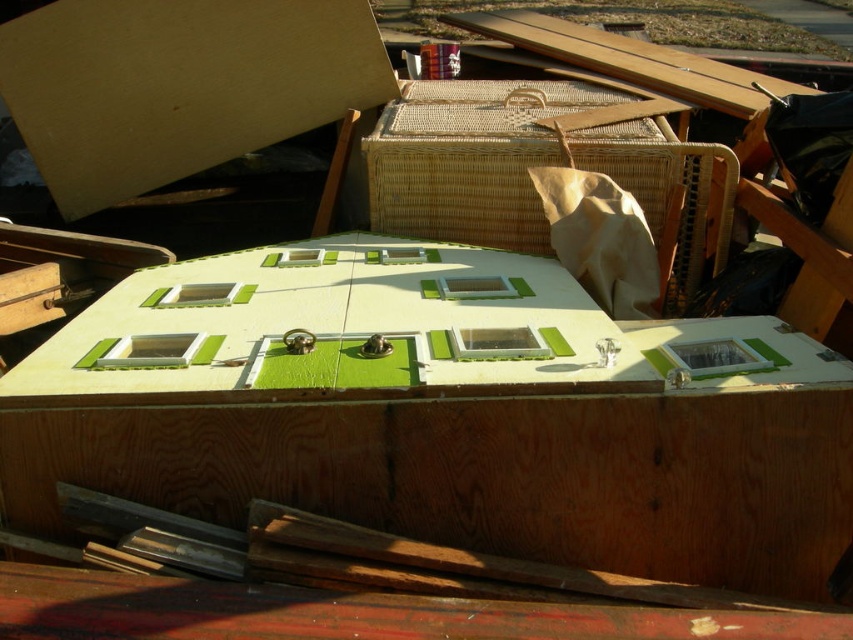
Question: Which object appears farthest from the camera in this image?

Choices:
 (A) matte cardboard at upper left
 (B) woven rattan crate at center

Answer: (A)

Question: Is matte cardboard at upper left bigger than woven rattan crate at center?

Choices:
 (A) no
 (B) yes

Answer: (A)

Question: Is matte cardboard at upper left thinner than woven rattan crate at center?

Choices:
 (A) yes
 (B) no

Answer: (B)

Question: Which point appears farthest from the camera in this image?

Choices:
 (A) tap(132, 188)
 (B) tap(505, 237)

Answer: (A)

Question: Can you confirm if matte cardboard at upper left is positioned to the left of woven rattan crate at center?

Choices:
 (A) yes
 (B) no

Answer: (A)